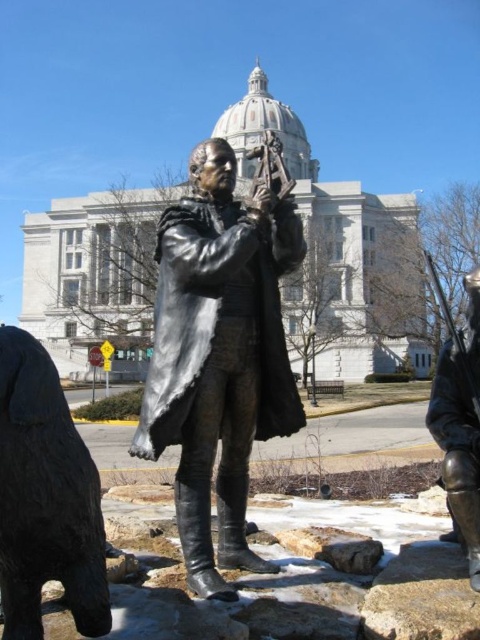
Question: Is bronze statue at center closer to the viewer compared to black polished bear at lower left?

Choices:
 (A) yes
 (B) no

Answer: (B)

Question: Among these objects, which one is nearest to the camera?

Choices:
 (A) black polished bear at lower left
 (B) bronze statue at center

Answer: (A)

Question: Can you confirm if black polished bear at lower left is positioned to the left of bronze statue at right?

Choices:
 (A) no
 (B) yes

Answer: (B)

Question: Which of these objects is positioned closest to the bronze statue at right?

Choices:
 (A) black polished bear at lower left
 (B) bronze statue at center

Answer: (B)

Question: Can you confirm if bronze statue at center is positioned to the right of bronze statue at right?

Choices:
 (A) no
 (B) yes

Answer: (A)

Question: Which of the following is the farthest from the observer?

Choices:
 (A) black polished bear at lower left
 (B) bronze statue at center

Answer: (B)